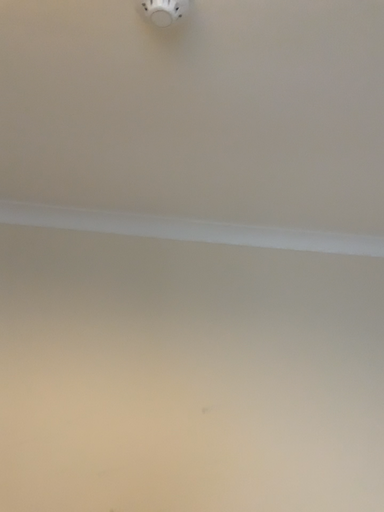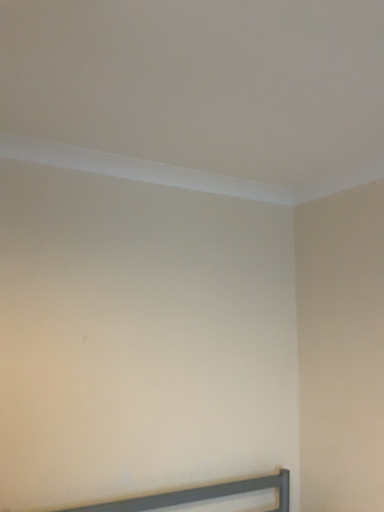
Question: How did the camera likely rotate when shooting the video?

Choices:
 (A) rotated right
 (B) rotated left

Answer: (A)